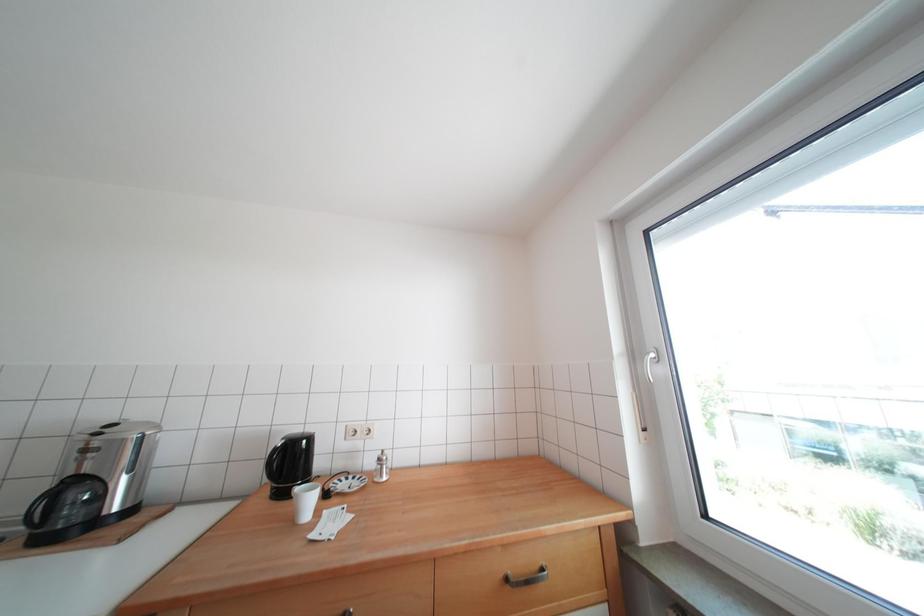
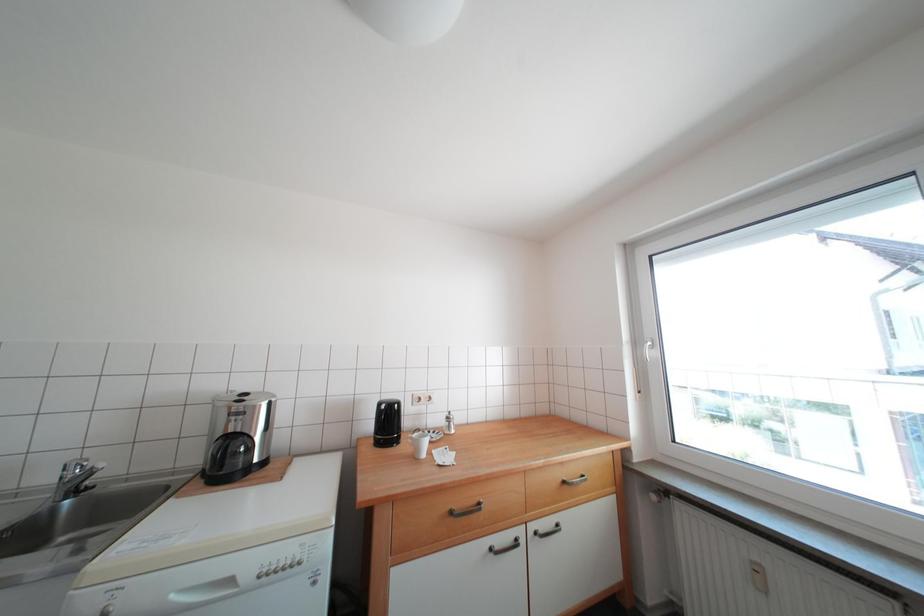
Question: How did the camera likely rotate?

Choices:
 (A) Left
 (B) Right
 (C) Up
 (D) Down

Answer: (B)